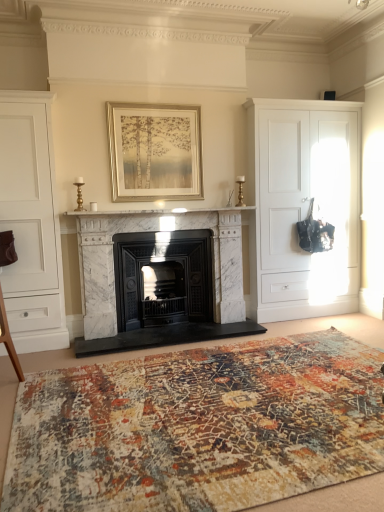
Question: In which direction should I rotate to look at black cast iron wood burning stove at center?

Choices:
 (A) left
 (B) right

Answer: (A)

Question: Considering the relative sizes of black cast iron wood burning stove at center and gold metallic picture frame at upper center in the image provided, is black cast iron wood burning stove at center wider than gold metallic picture frame at upper center?

Choices:
 (A) no
 (B) yes

Answer: (B)

Question: Is the position of black cast iron wood burning stove at center more distant than that of gold metallic picture frame at upper center?

Choices:
 (A) no
 (B) yes

Answer: (B)

Question: From the image's perspective, is black cast iron wood burning stove at center under gold metallic picture frame at upper center?

Choices:
 (A) no
 (B) yes

Answer: (B)

Question: Can you see black cast iron wood burning stove at center touching gold metallic picture frame at upper center?

Choices:
 (A) no
 (B) yes

Answer: (A)

Question: Is black cast iron wood burning stove at center not within gold metallic picture frame at upper center?

Choices:
 (A) yes
 (B) no

Answer: (A)

Question: From a real-world perspective, is black cast iron wood burning stove at center positioned under gold metallic picture frame at upper center based on gravity?

Choices:
 (A) yes
 (B) no

Answer: (A)

Question: From a real-world perspective, is white matte cabinet at right, which is counted as the 2th cabinetry, starting from the front, physically above black cast iron wood burning stove at center?

Choices:
 (A) yes
 (B) no

Answer: (A)

Question: Is white matte cabinet at right, the 1th cabinetry viewed from the right, completely or partially outside of black cast iron wood burning stove at center?

Choices:
 (A) yes
 (B) no

Answer: (A)

Question: Is white matte cabinet at right, the 1th cabinetry viewed from the right, turned away from black cast iron wood burning stove at center?

Choices:
 (A) no
 (B) yes

Answer: (A)

Question: From the image's perspective, is white matte cabinet at right, which is the second cabinetry from left to right, over black cast iron wood burning stove at center?

Choices:
 (A) yes
 (B) no

Answer: (A)

Question: Can you confirm if white matte cabinet at right, which is counted as the 2th cabinetry, starting from the front, is positioned to the left of black cast iron wood burning stove at center?

Choices:
 (A) no
 (B) yes

Answer: (A)

Question: Is white matte cabinet at right, the 1th cabinetry viewed from the right, taller than black cast iron wood burning stove at center?

Choices:
 (A) yes
 (B) no

Answer: (A)

Question: From a real-world perspective, is white marble fireplace at center on white matte cabinet at left, which is counted as the 1th cabinetry, starting from the left?

Choices:
 (A) yes
 (B) no

Answer: (A)